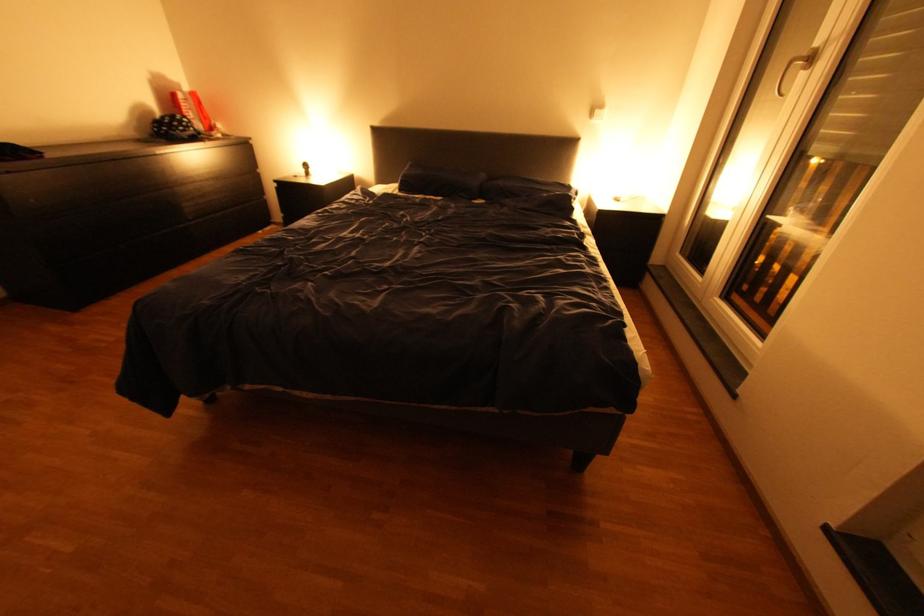
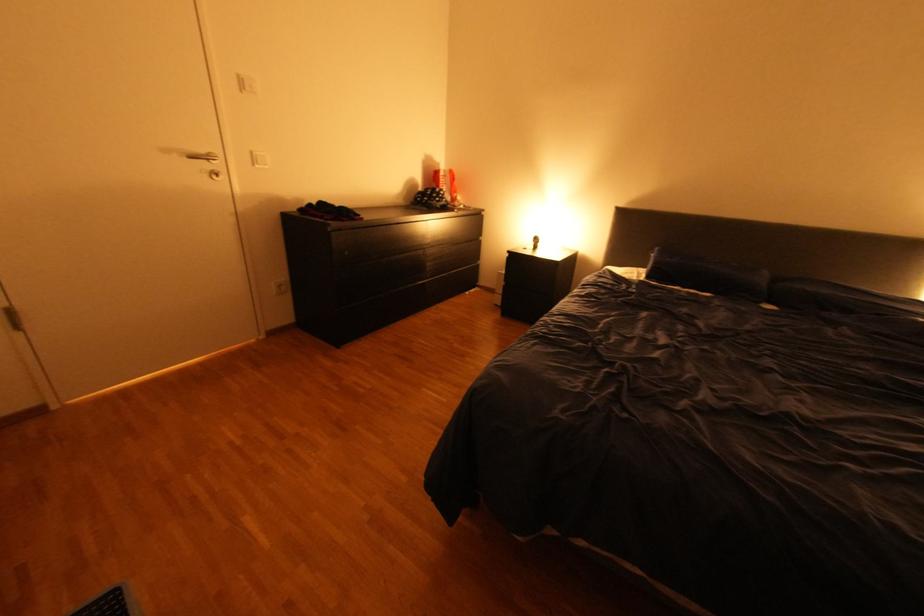
Where in the second image is the point corresponding to the point at 211,180 from the first image?

(454, 244)